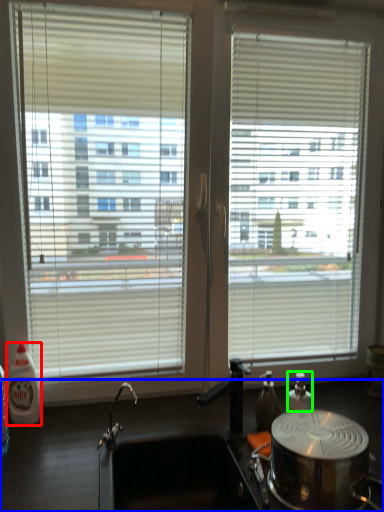
Question: Considering the real-world distances, which object is closest to bottle (highlighted by a red box)? counter top (highlighted by a blue box) or bottle (highlighted by a green box).

Choices:
 (A) counter top
 (B) bottle

Answer: (A)